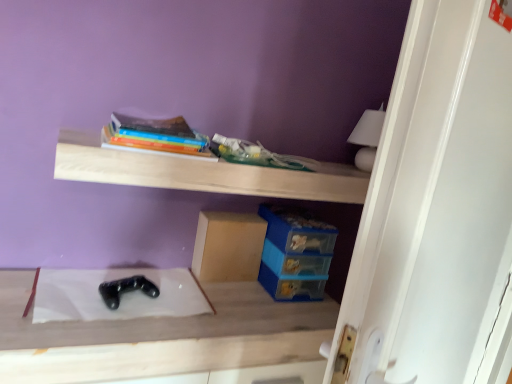
In order to click on free spot to the right of black matte game controller at lower center in this screenshot , I will do `click(201, 314)`.